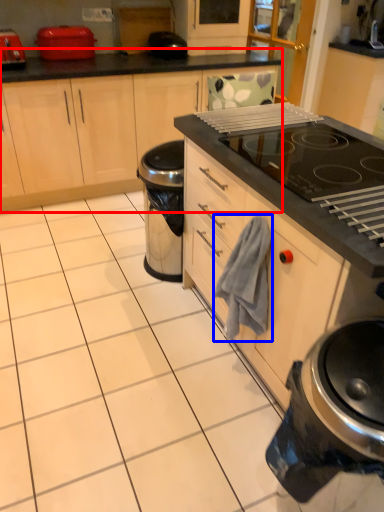
Question: Among these objects, which one is farthest to the camera, cabinetry (highlighted by a red box) or hand towel (highlighted by a blue box)?

Choices:
 (A) cabinetry
 (B) hand towel

Answer: (A)